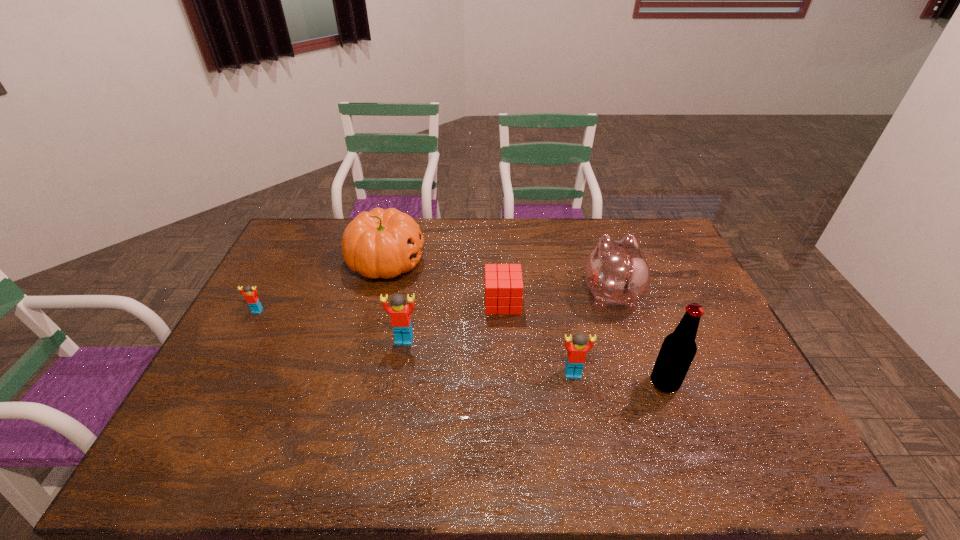
Given the evenly spaced Legos in the image, where should an extra Lego be added on the right to preserve the spacing? Please point to a vacant space. Please provide its 2D coordinates. Your answer should be formatted as a tuple, i.e. [(x, y)], where the tuple contains the x and y coordinates of a point satisfying the conditions above.

[(769, 413)]